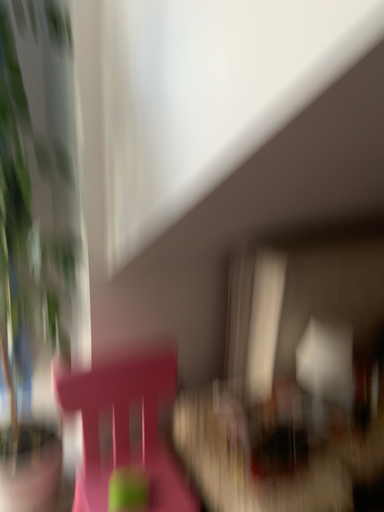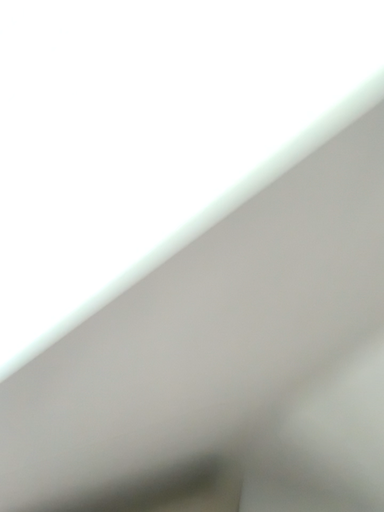
Question: How did the camera likely rotate when shooting the video?

Choices:
 (A) rotated left
 (B) rotated right

Answer: (B)